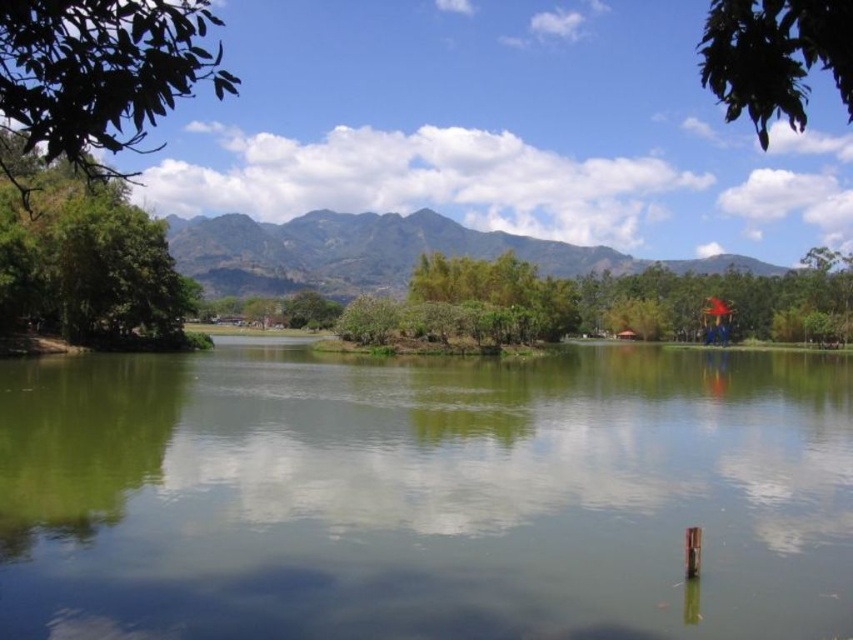
Question: Among these points, which one is farthest from the camera?

Choices:
 (A) (404, 369)
 (B) (790, 16)
 (C) (0, 49)

Answer: (A)

Question: Can you confirm if green reflective water at center is thinner than green leafy tree at upper right?

Choices:
 (A) yes
 (B) no

Answer: (A)

Question: Which of these objects is positioned farthest from the green reflective water at center?

Choices:
 (A) green leafy tree at upper left
 (B) green textured mountain at upper center
 (C) green leafy tree at left

Answer: (B)

Question: Does green reflective water at center appear on the right side of green leafy tree at upper right?

Choices:
 (A) no
 (B) yes

Answer: (A)

Question: Which point is closer to the camera taking this photo?

Choices:
 (A) coord(187,92)
 (B) coord(490,540)

Answer: (A)

Question: Where is green reflective water at center located in relation to green textured mountain at upper center in the image?

Choices:
 (A) left
 (B) right

Answer: (A)